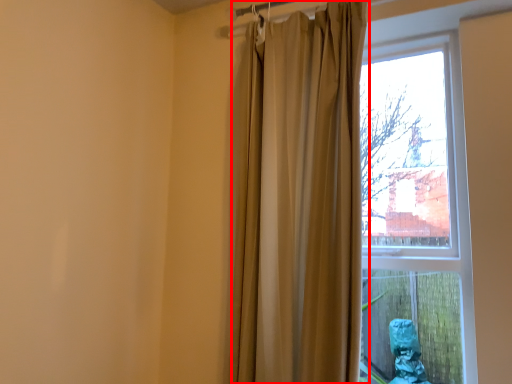
Question: Considering the relative positions of curtain (annotated by the red box) and window in the image provided, where is curtain (annotated by the red box) located with respect to the staircase?

Choices:
 (A) left
 (B) right

Answer: (A)